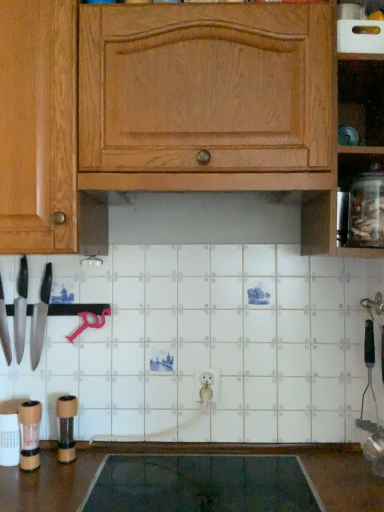
Question: Is the depth of wooden pepper grinder at lower left, which appears as the 1th appliance when viewed from the left, less than that of matte black knife at left, the 1th knife when ordered from right to left?

Choices:
 (A) no
 (B) yes

Answer: (B)

Question: Can you confirm if wooden pepper grinder at lower left, the 1th appliance from the front, is bigger than matte black knife at left, marked as the 3th knife in a left-to-right arrangement?

Choices:
 (A) yes
 (B) no

Answer: (B)

Question: Can you confirm if wooden pepper grinder at lower left, the 1th appliance from the front, is thinner than matte black knife at left, the 1th knife when ordered from right to left?

Choices:
 (A) yes
 (B) no

Answer: (A)

Question: Is wooden pepper grinder at lower left, which is counted as the second appliance, starting from the back, at the left side of matte black knife at left, the 1th knife when ordered from right to left?

Choices:
 (A) yes
 (B) no

Answer: (B)

Question: Is wooden pepper grinder at lower left, which appears as the 1th appliance when viewed from the left, smaller than matte black knife at left, marked as the 3th knife in a left-to-right arrangement?

Choices:
 (A) yes
 (B) no

Answer: (A)

Question: Is brown matte pepper grinder at lower left, positioned as the second appliance in left-to-right order, situated inside dark gray rubber mat at lower center or outside?

Choices:
 (A) inside
 (B) outside

Answer: (B)

Question: Would you say brown matte pepper grinder at lower left, positioned as the second appliance in front-to-back order, is to the left or to the right of dark gray rubber mat at lower center in the picture?

Choices:
 (A) right
 (B) left

Answer: (B)

Question: Is point click(x=69, y=400) closer or farther from the camera than point click(x=76, y=462)?

Choices:
 (A) closer
 (B) farther

Answer: (B)

Question: Looking at their shapes, would you say brown matte pepper grinder at lower left, which is the first appliance from back to front, is wider or thinner than dark gray rubber mat at lower center?

Choices:
 (A) thin
 (B) wide

Answer: (A)

Question: Visually, is wooden pepper grinder at lower left, arranged as the 2th appliance when viewed from the right, positioned to the left or to the right of polished silver knife at left, the 2th knife viewed from the right?

Choices:
 (A) left
 (B) right

Answer: (B)

Question: In terms of height, does wooden pepper grinder at lower left, which appears as the 1th appliance when viewed from the left, look taller or shorter compared to polished silver knife at left, the 2th knife viewed from the left?

Choices:
 (A) short
 (B) tall

Answer: (A)

Question: From a real-world perspective, is wooden pepper grinder at lower left, which is counted as the second appliance, starting from the back, physically located above or below polished silver knife at left, the 2th knife viewed from the right?

Choices:
 (A) above
 (B) below

Answer: (B)

Question: Is wooden pepper grinder at lower left, the 1th appliance from the front, bigger or smaller than polished silver knife at left, the 2th knife viewed from the right?

Choices:
 (A) small
 (B) big

Answer: (A)

Question: Looking at the image, does polished silver knife at left, the 2th knife viewed from the left, seem bigger or smaller compared to clear glass jar at right?

Choices:
 (A) small
 (B) big

Answer: (A)

Question: Relative to clear glass jar at right, is polished silver knife at left, the 2th knife viewed from the left, in front or behind?

Choices:
 (A) front
 (B) behind

Answer: (B)